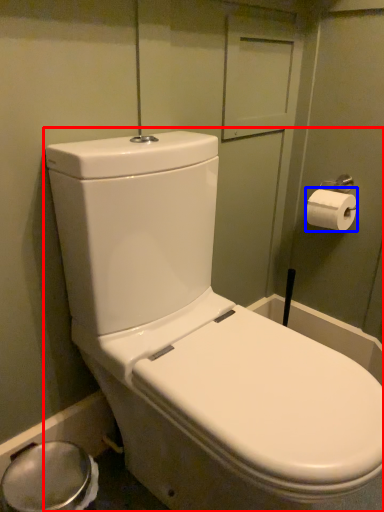
Question: Which object appears closest to the camera in this image, toilet (highlighted by a red box) or toilet paper (highlighted by a blue box)?

Choices:
 (A) toilet
 (B) toilet paper

Answer: (A)